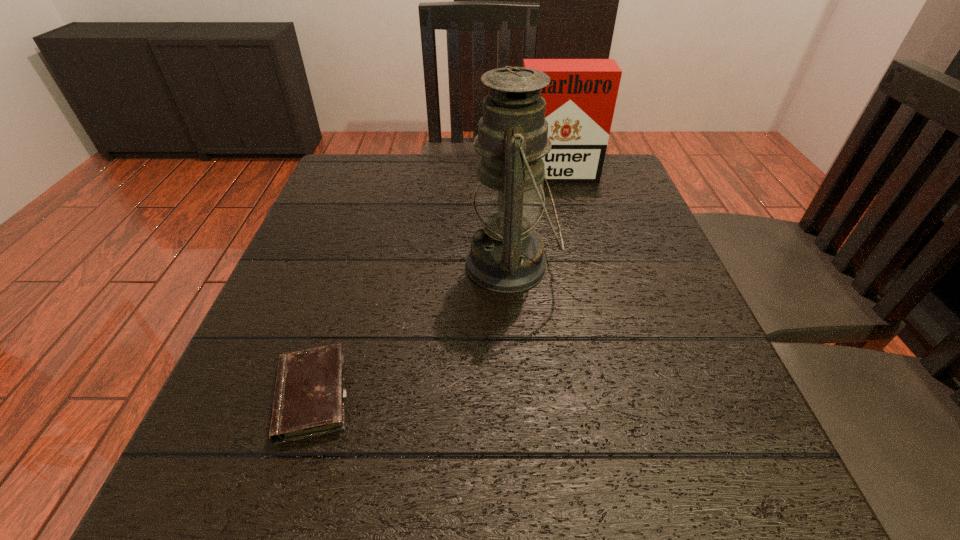
Identify the location of object located at the left edge. This screenshot has width=960, height=540. (309, 397).

The width and height of the screenshot is (960, 540). I want to click on object positioned at the right edge, so click(x=580, y=99).

Locate an element on the screen. object that is at the far right corner is located at coordinates (580, 99).

The image size is (960, 540). What are the coordinates of `free space at the far edge` in the screenshot? It's located at (417, 192).

You are a GUI agent. You are given a task and a screenshot of the screen. Output one action in this format:
    pyautogui.click(x=<x>, y=<y>)
    Task: Click on the free region at the left edge of the desktop
    This screenshot has height=540, width=960.
    Given the screenshot: What is the action you would take?
    pyautogui.click(x=308, y=260)

In the image, there is a desktop. At what (x,y) coordinates should I click in order to perform the action: click on vacant space at the right edge. Please return your answer as a coordinate pair (x, y). Image resolution: width=960 pixels, height=540 pixels. Looking at the image, I should click on (605, 204).

Identify the location of free space at the far left corner. (340, 170).

Find the location of `vacant space at the far right corner`. vacant space at the far right corner is located at coordinates (612, 192).

The width and height of the screenshot is (960, 540). I want to click on vacant space at the near right corner of the desktop, so click(780, 472).

This screenshot has width=960, height=540. Find the location of `empty location between the diary and the tallest object`. empty location between the diary and the tallest object is located at coordinates (411, 330).